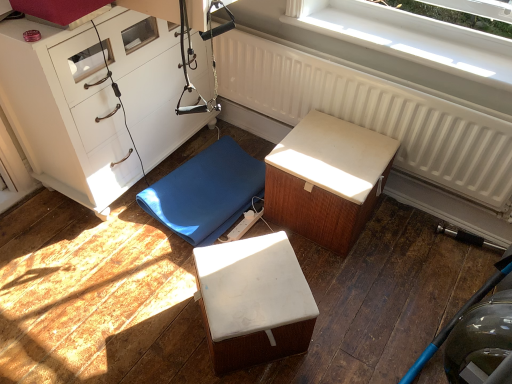
Where is `free space above white matte cube at center, placed as the 2th furniture when sorted from left to right (from a real-world perspective)`? free space above white matte cube at center, placed as the 2th furniture when sorted from left to right (from a real-world perspective) is located at coordinates (247, 277).